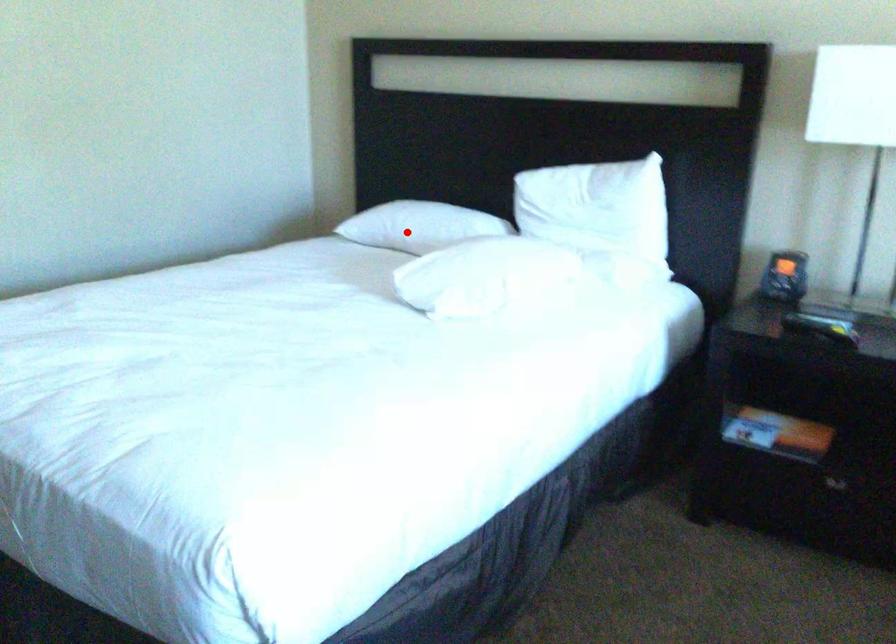
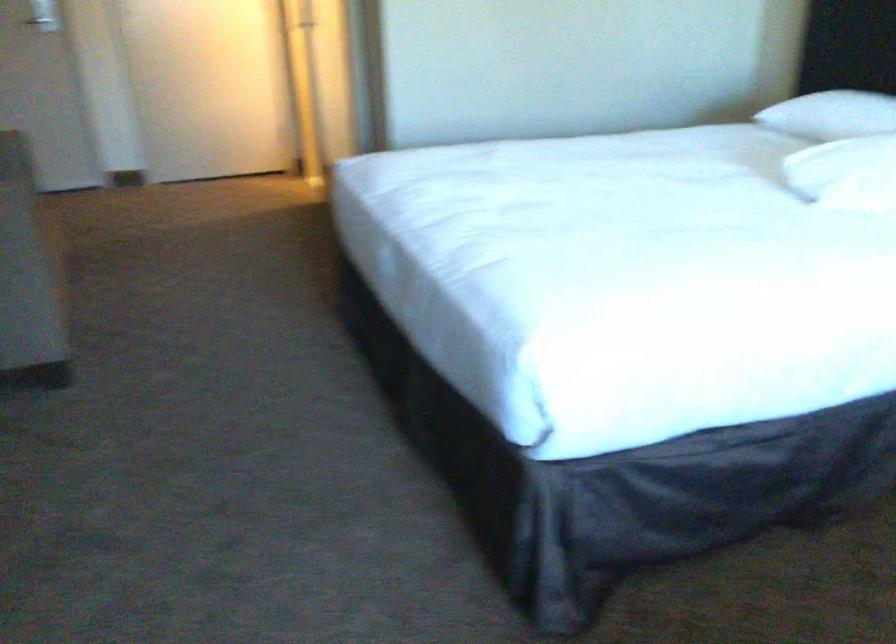
Question: I am providing you with two images of the same scene from different viewpoints. In image1, a red point is highlighted. Considering the same 3D point in image2, which of the following is correct?

Choices:
 (A) It is closer
 (B) It is farther

Answer: (A)